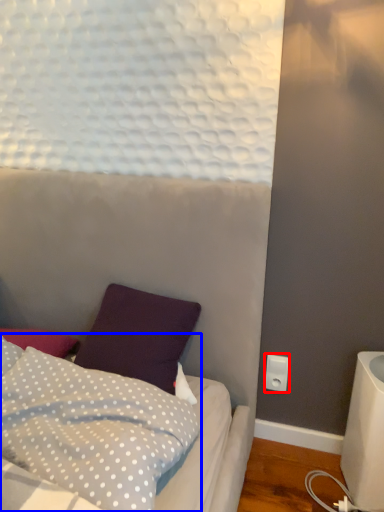
Question: Which of the following is the closest to the observer, electric outlet (highlighted by a red box) or pillow (highlighted by a blue box)?

Choices:
 (A) electric outlet
 (B) pillow

Answer: (B)